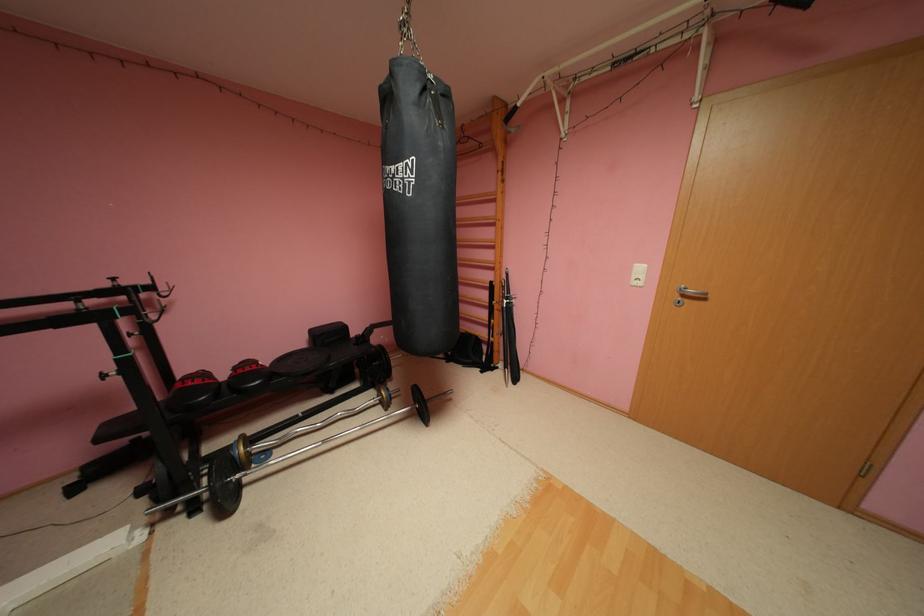
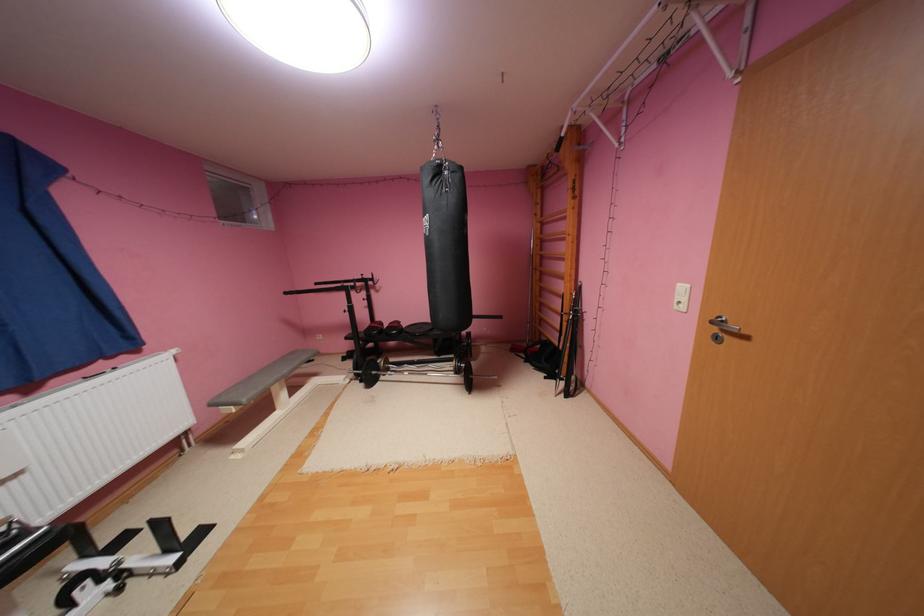
Find the pixel in the second image that matches (691,296) in the first image.

(733, 330)